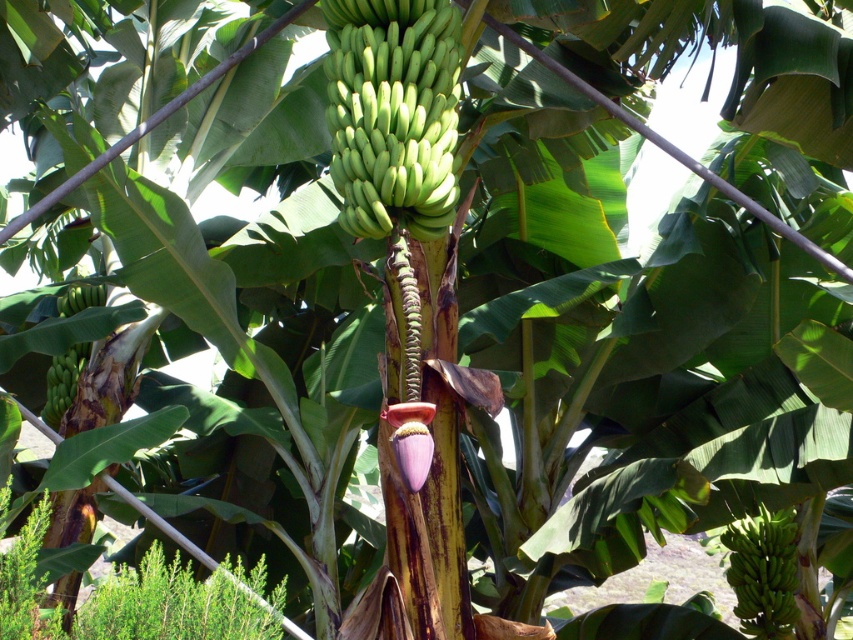
Which of these two, green matte bananas at center or green matte bananas at left, stands taller?

With more height is green matte bananas at center.

Does green matte bananas at center appear on the right side of green matte bananas at left?

Yes, green matte bananas at center is to the right of green matte bananas at left.

Where is `green matte bananas at center`? The image size is (853, 640). green matte bananas at center is located at coordinates pos(393,113).

Who is positioned more to the left, green matte bananas at center or green matte bananas at lower right?

From the viewer's perspective, green matte bananas at center appears more on the left side.

Is point (395, 58) more distant than point (779, 529)?

No, it is in front of (779, 529).

You are a GUI agent. You are given a task and a screenshot of the screen. Output one action in this format:
    pyautogui.click(x=<x>, y=<y>)
    Task: Click on the green matte bananas at center
    
    Given the screenshot: What is the action you would take?
    pyautogui.click(x=393, y=113)

Can you confirm if green matte bananas at lower right is shorter than green matte bananas at left?

No.

The height and width of the screenshot is (640, 853). I want to click on green matte bananas at lower right, so click(763, 572).

Identify the location of green matte bananas at lower right. The width and height of the screenshot is (853, 640). (763, 572).